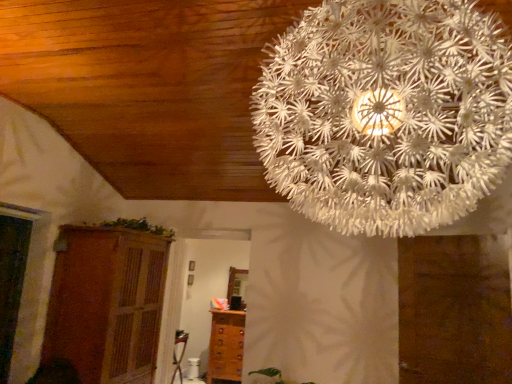
In order to face brown wooden chest of drawers at lower center, should I rotate leftwards or rightwards?

You should rotate left by 3.578 degrees.

Image resolution: width=512 pixels, height=384 pixels. What are the coordinates of `wooden cupboard at lower left` in the screenshot? It's located at (106, 303).

Is there a large distance between green leafy plant at upper center and brown wooden chest of drawers at lower center?

green leafy plant at upper center is far away from brown wooden chest of drawers at lower center.

Between green leafy plant at upper center and brown wooden chest of drawers at lower center, which one has larger width?

With larger width is green leafy plant at upper center.

In terms of height, does green leafy plant at upper center look taller or shorter compared to brown wooden chest of drawers at lower center?

Considering their sizes, green leafy plant at upper center has less height than brown wooden chest of drawers at lower center.

Does point (106, 223) lie in front of point (237, 316)?

Yes, it is in front of point (237, 316).

From the image's perspective, is green leafy plant at upper center on wooden cupboard at lower left?

Indeed, from the image's perspective, green leafy plant at upper center is shown above wooden cupboard at lower left.

Considering the sizes of objects green leafy plant at upper center and wooden cupboard at lower left in the image provided, who is thinner, green leafy plant at upper center or wooden cupboard at lower left?

With smaller width is green leafy plant at upper center.

Would you say green leafy plant at upper center is inside or outside wooden cupboard at lower left?

green leafy plant at upper center is spatially situated outside wooden cupboard at lower left.

Can you confirm if green leafy plant at upper center is positioned to the right of wooden cupboard at lower left?

Yes.

Could you tell me if wooden cupboard at lower left is facing green leafy plant at upper center?

No, wooden cupboard at lower left does not turn towards green leafy plant at upper center.

Is there a large distance between wooden cupboard at lower left and green leafy plant at upper center?

They are positioned close to each other.

From a real-world perspective, who is located higher, wooden cupboard at lower left or green leafy plant at upper center?

green leafy plant at upper center.

Which is more to the right, wooden cupboard at lower left or green leafy plant at upper center?

Positioned to the right is green leafy plant at upper center.

Is green leafy plant at upper center to the right of white paper-like at upper center from the viewer's perspective?

No, green leafy plant at upper center is not to the right of white paper-like at upper center.

Does point (167, 229) appear closer or farther from the camera than point (367, 198)?

Clearly, point (167, 229) is more distant from the camera than point (367, 198).

Where is `plant that is on the left side of white paper-like at upper center`? plant that is on the left side of white paper-like at upper center is located at coordinates (138, 226).

Considering the sizes of objects white paper-like at upper center and wooden cupboard at lower left in the image provided, who is taller, white paper-like at upper center or wooden cupboard at lower left?

wooden cupboard at lower left.

From the image's perspective, which is above, white paper-like at upper center or wooden cupboard at lower left?

white paper-like at upper center appears higher in the image.

Is point (435, 41) closer to camera compared to point (117, 236)?

Yes, it is in front of point (117, 236).

Looking at this image, who is smaller, white paper-like at upper center or wooden cupboard at lower left?

Smaller between the two is white paper-like at upper center.

Is brown wooden chest of drawers at lower center wider than wooden cupboard at lower left?

No.

Looking at the image, does brown wooden chest of drawers at lower center seem bigger or smaller compared to wooden cupboard at lower left?

Considering their sizes, brown wooden chest of drawers at lower center takes up less space than wooden cupboard at lower left.

Does brown wooden chest of drawers at lower center have a greater height compared to wooden cupboard at lower left?

No.

Is brown wooden chest of drawers at lower center further to the viewer compared to wooden cupboard at lower left?

Yes, it is.

Which object is more forward, white paper-like at upper center or brown wooden chest of drawers at lower center?

white paper-like at upper center.

Which is in front, point (442, 137) or point (223, 333)?

The point (442, 137) is more forward.

Is white paper-like at upper center beside brown wooden chest of drawers at lower center?

white paper-like at upper center is not next to brown wooden chest of drawers at lower center, and they're not touching.

In terms of height, does white paper-like at upper center look taller or shorter compared to brown wooden chest of drawers at lower center?

In the image, white paper-like at upper center appears to be taller than brown wooden chest of drawers at lower center.

This screenshot has height=384, width=512. I want to click on the chest of drawers below the green leafy plant at upper center (from the image's perspective), so click(x=226, y=346).

Locate an element on the screen. This screenshot has width=512, height=384. cupboard below the green leafy plant at upper center (from a real-world perspective) is located at coordinates (106, 303).

Based on their spatial positions, is white paper-like at upper center or wooden cupboard at lower left closer to green leafy plant at upper center?

wooden cupboard at lower left.

Estimate the real-world distances between objects in this image. Which object is further from white paper-like at upper center, wooden cupboard at lower left or green leafy plant at upper center?

green leafy plant at upper center lies further to white paper-like at upper center than the other object.

Which object lies nearer to the anchor point wooden cupboard at lower left, white paper-like at upper center or green leafy plant at upper center?

The object closer to wooden cupboard at lower left is green leafy plant at upper center.

Which object lies further to the anchor point green leafy plant at upper center, wooden cupboard at lower left or white paper-like at upper center?

The object further to green leafy plant at upper center is white paper-like at upper center.

Considering their positions, is white paper-like at upper center positioned closer to green leafy plant at upper center than brown wooden chest of drawers at lower center?

brown wooden chest of drawers at lower center is closer to green leafy plant at upper center.

Considering their positions, is green leafy plant at upper center positioned closer to white paper-like at upper center than wooden cupboard at lower left?

wooden cupboard at lower left.

Which object lies further to the anchor point brown wooden chest of drawers at lower center, wooden cupboard at lower left or white paper-like at upper center?

white paper-like at upper center lies further to brown wooden chest of drawers at lower center than the other object.

Considering their positions, is green leafy plant at upper center positioned closer to wooden cupboard at lower left than white paper-like at upper center?

The object closer to wooden cupboard at lower left is green leafy plant at upper center.

The width and height of the screenshot is (512, 384). Identify the location of cupboard between white paper-like at upper center and green leafy plant at upper center along the z-axis. (106, 303).

This screenshot has width=512, height=384. What are the coordinates of `plant between wooden cupboard at lower left and brown wooden chest of drawers at lower center from front to back` in the screenshot? It's located at (138, 226).

Find the location of `plant between white paper-like at upper center and brown wooden chest of drawers at lower center in the front-back direction`. plant between white paper-like at upper center and brown wooden chest of drawers at lower center in the front-back direction is located at coordinates (138, 226).

Locate an element on the screen. This screenshot has height=384, width=512. cupboard located between white paper-like at upper center and brown wooden chest of drawers at lower center in the depth direction is located at coordinates (106, 303).